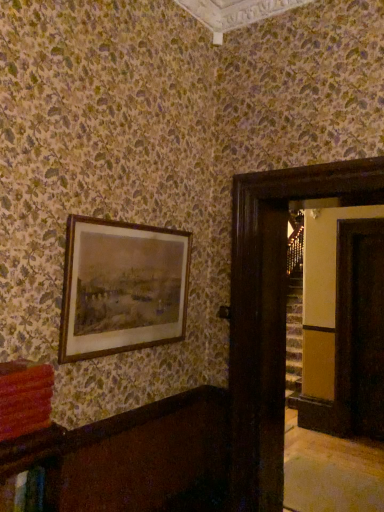
Question: Is matte red book at lower left positioned behind dark wood door at right, placed as the first glass door when sorted from front to back?

Choices:
 (A) yes
 (B) no

Answer: (B)

Question: Is matte red book at lower left beside dark wood door at right, placed as the first glass door when sorted from front to back?

Choices:
 (A) yes
 (B) no

Answer: (B)

Question: Would you say matte red book at lower left contains dark wood door at right, which ranks as the 1th glass door in left-to-right order?

Choices:
 (A) yes
 (B) no

Answer: (B)

Question: From a real-world perspective, is matte red book at lower left below dark wood door at right, acting as the 2th glass door starting from the back?

Choices:
 (A) yes
 (B) no

Answer: (B)

Question: Is matte red book at lower left at the left side of dark wood door at right, placed as the first glass door when sorted from front to back?

Choices:
 (A) yes
 (B) no

Answer: (A)

Question: Is point (365, 318) closer or farther from the camera than point (334, 188)?

Choices:
 (A) closer
 (B) farther

Answer: (B)

Question: From a real-world perspective, is transparent glass door at right, arranged as the first glass door when viewed from the right, physically located above or below dark wood door at right, which ranks as the 2th glass door in right-to-left order?

Choices:
 (A) above
 (B) below

Answer: (B)

Question: In the image, is transparent glass door at right, the second glass door when ordered from front to back, positioned in front of or behind dark wood door at right, which ranks as the 1th glass door in left-to-right order?

Choices:
 (A) behind
 (B) front

Answer: (A)

Question: In terms of height, does transparent glass door at right, the second glass door from the left, look taller or shorter compared to dark wood door at right, placed as the first glass door when sorted from front to back?

Choices:
 (A) tall
 (B) short

Answer: (B)

Question: Considering the relative positions of brown wooden picture frame at upper left and matte red book at lower left in the image provided, is brown wooden picture frame at upper left to the left or to the right of matte red book at lower left?

Choices:
 (A) right
 (B) left

Answer: (A)

Question: Considering the positions of point (168, 327) and point (4, 386), is point (168, 327) closer or farther from the camera than point (4, 386)?

Choices:
 (A) farther
 (B) closer

Answer: (A)

Question: From a real-world perspective, is brown wooden picture frame at upper left positioned above or below matte red book at lower left?

Choices:
 (A) below
 (B) above

Answer: (B)

Question: Considering the positions of brown wooden picture frame at upper left and matte red book at lower left in the image, is brown wooden picture frame at upper left wider or thinner than matte red book at lower left?

Choices:
 (A) thin
 (B) wide

Answer: (A)

Question: Would you say brown wooden picture frame at upper left is inside or outside transparent glass door at right, the second glass door when ordered from front to back?

Choices:
 (A) outside
 (B) inside

Answer: (A)

Question: Does point (135, 322) appear closer or farther from the camera than point (360, 219)?

Choices:
 (A) closer
 (B) farther

Answer: (A)